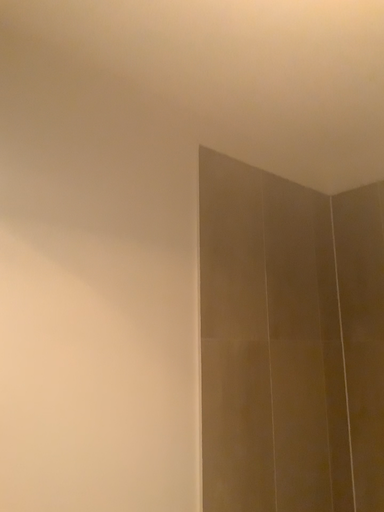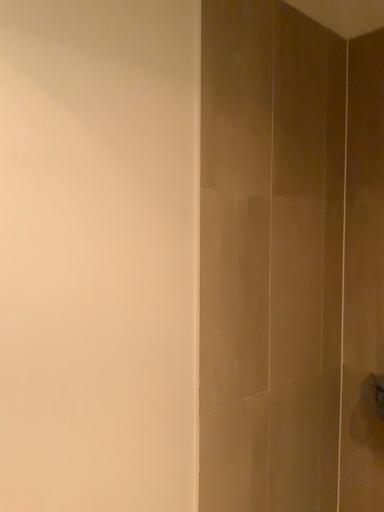
Question: Which way did the camera rotate in the video?

Choices:
 (A) rotated downward
 (B) rotated upward

Answer: (A)